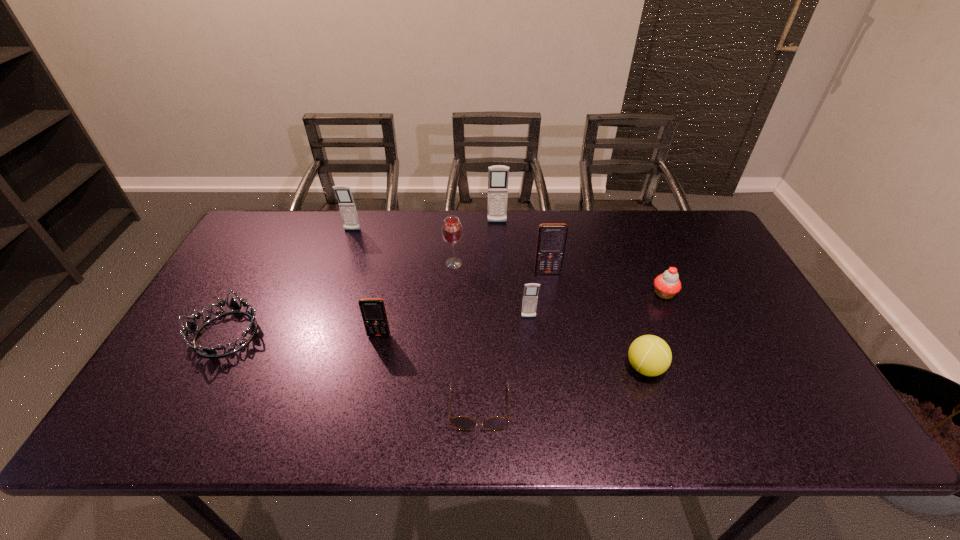
Where is `the fourth object from right to left`? The image size is (960, 540). the fourth object from right to left is located at coordinates (530, 296).

Locate an element on the screen. The image size is (960, 540). the rightmost object is located at coordinates (667, 285).

Locate an element on the screen. red cupcake is located at coordinates coord(667,285).

Where is `green tennis ball`? The height and width of the screenshot is (540, 960). green tennis ball is located at coordinates (649, 355).

You are a GUI agent. You are given a task and a screenshot of the screen. Output one action in this format:
    pyautogui.click(x=<x>, y=<y>)
    Task: Click on the second object from right to left
    
    Given the screenshot: What is the action you would take?
    pyautogui.click(x=649, y=355)

Where is `tiara`? tiara is located at coordinates (193, 328).

At what (x,y) coordinates should I click in order to perform the action: click on the ninth tallest object. Please return your answer as a coordinate pair (x, y). Image resolution: width=960 pixels, height=540 pixels. Looking at the image, I should click on (193, 328).

This screenshot has height=540, width=960. Find the location of `gray sunglasses`. gray sunglasses is located at coordinates (460, 422).

The height and width of the screenshot is (540, 960). What are the coordinates of `the shortest object` in the screenshot? It's located at (460, 422).

The height and width of the screenshot is (540, 960). In order to click on free location located 0.060m on the front-facing side of the farthest cellular telephone in this screenshot , I will do `click(497, 236)`.